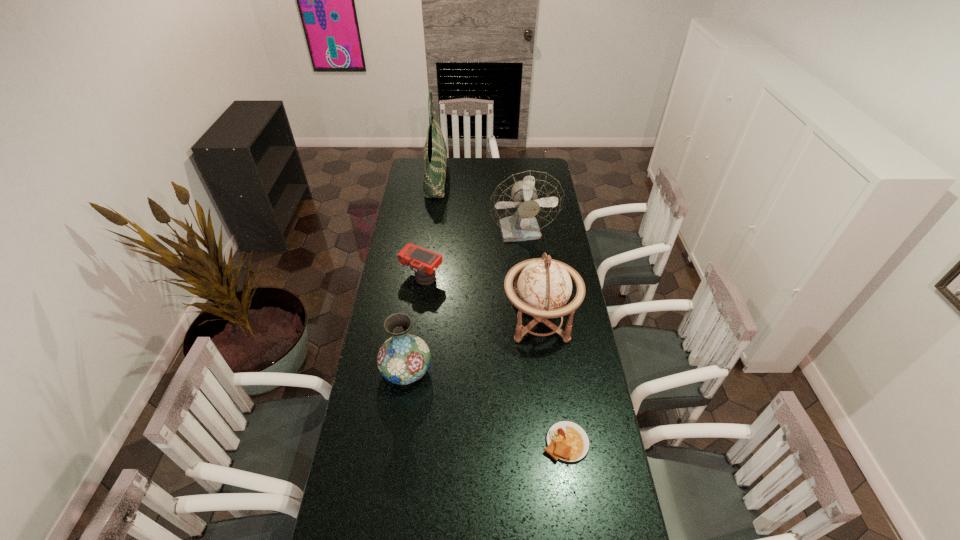
Where is `camera situated at the left edge`? The width and height of the screenshot is (960, 540). camera situated at the left edge is located at coordinates (423, 262).

Identify the location of fan present at the right edge. The width and height of the screenshot is (960, 540). (523, 204).

You are a GUI agent. You are given a task and a screenshot of the screen. Output one action in this format:
    pyautogui.click(x=<x>, y=<y>)
    Task: Click on the globe present at the right edge
    The image size is (960, 540).
    Given the screenshot: What is the action you would take?
    pyautogui.click(x=544, y=286)

Locate an element on the screen. Image resolution: width=960 pixels, height=540 pixels. omelet that is at the right edge is located at coordinates (566, 441).

Where is `object at the far left corner`? The height and width of the screenshot is (540, 960). object at the far left corner is located at coordinates (435, 152).

The width and height of the screenshot is (960, 540). I want to click on vacant space at the far edge, so click(496, 160).

In the image, there is a desktop. Where is `free space at the left edge`? The width and height of the screenshot is (960, 540). free space at the left edge is located at coordinates (347, 495).

Find the location of `vacant space at the right edge of the desktop`. vacant space at the right edge of the desktop is located at coordinates (598, 416).

In the image, there is a desktop. What are the coordinates of `vacant space at the far right corner` in the screenshot? It's located at pyautogui.click(x=540, y=171).

I want to click on vacant space that's between the vase and the second farthest object, so click(465, 302).